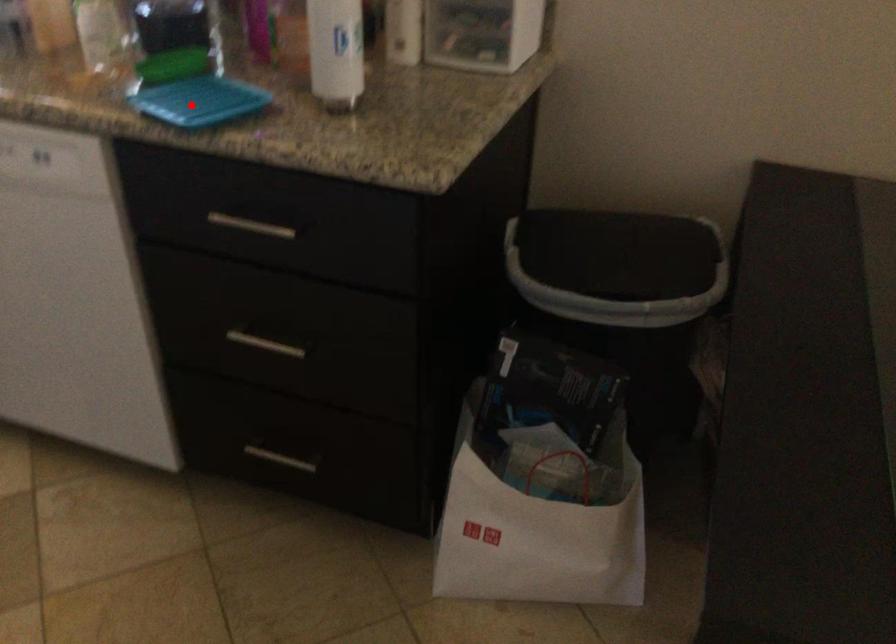
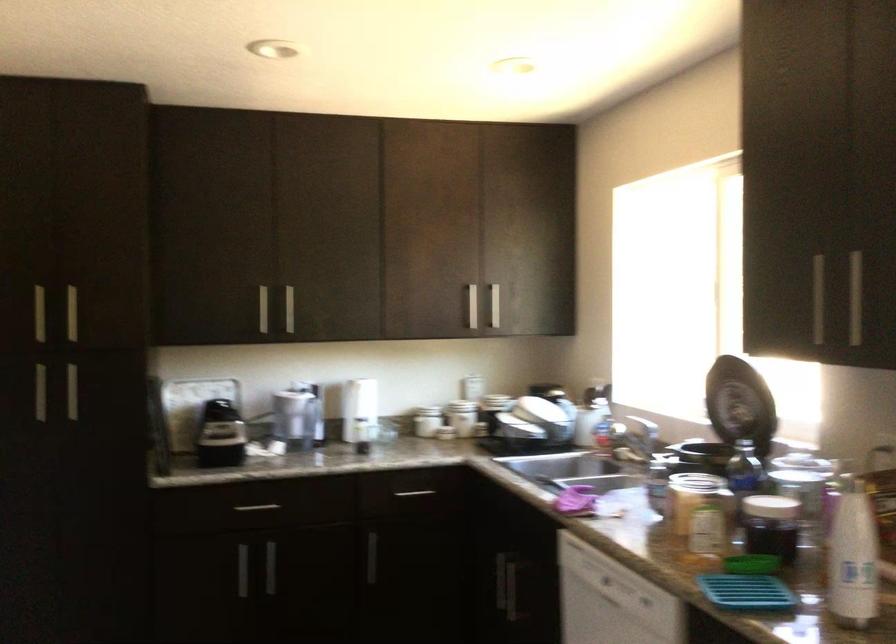
Where in the second image is the point corresponding to the highlighted location from the first image?

(745, 592)